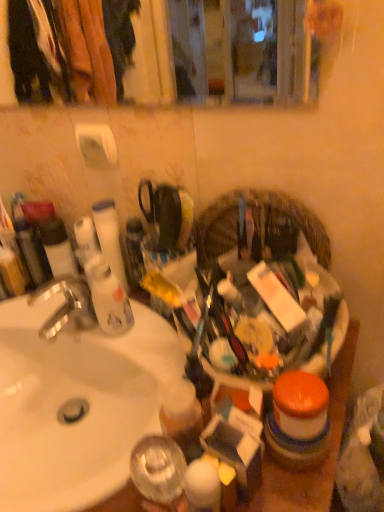
Find the location of `matte black tube at left`. matte black tube at left is located at coordinates (57, 247).

In order to face white matte toilet paper at upper left, the 1th toilet paper in the top-to-bottom sequence, should I rotate leftwards or rightwards?

A 13.010 degree turn to the left will do.

Measure the distance between white matte tube at left, the first toilet paper when ordered from bottom to top, and camera.

A distance of 32.99 inches exists between white matte tube at left, the first toilet paper when ordered from bottom to top, and camera.

What is the approximate width of white matte tube at left, placed as the 2th toilet paper when sorted from top to bottom?

The width of white matte tube at left, placed as the 2th toilet paper when sorted from top to bottom, is 2.93 inches.

Locate an element on the screen. This screenshot has width=384, height=512. plastic woven basket at center is located at coordinates (254, 206).

Based on the photo, what is the approximate height of silver metallic faucet at left?

silver metallic faucet at left is 5.10 inches tall.

You are a GUI agent. You are given a task and a screenshot of the screen. Output one action in this format:
    pyautogui.click(x=<x>, y=<y>)
    Task: Click on the matte black tube at left
    
    Given the screenshot: What is the action you would take?
    pyautogui.click(x=57, y=247)

Is matte black tube at left bigger or smaller than silver metallic faucet at left?

Considering their sizes, matte black tube at left takes up less space than silver metallic faucet at left.

Is silver metallic faucet at left at the back of matte black tube at left?

matte black tube at left does not have its back to silver metallic faucet at left.

In the scene shown: Is matte black tube at left not within silver metallic faucet at left?

That's correct, matte black tube at left is outside of silver metallic faucet at left.

From a real-world perspective, is matte black tube at left beneath plastic woven basket at center?

Indeed, from a real-world perspective, matte black tube at left is positioned beneath plastic woven basket at center.

How different are the orientations of matte black tube at left and plastic woven basket at center in degrees?

The angle between the facing direction of matte black tube at left and the facing direction of plastic woven basket at center is 0.00618 degrees.

Which is nearer, (53, 270) or (298, 215)?

Clearly, point (53, 270) is more distant from the camera than point (298, 215).

Is matte black tube at left oriented towards plastic woven basket at center?

No, matte black tube at left is not aimed at plastic woven basket at center.

In the scene shown: Is white matte tube at left, placed as the 2th toilet paper when sorted from top to bottom, not inside white glossy sink at left?

That's correct, white matte tube at left, placed as the 2th toilet paper when sorted from top to bottom, is outside of white glossy sink at left.

Which of these two, white matte tube at left, placed as the 2th toilet paper when sorted from top to bottom, or white glossy sink at left, stands taller?

white matte tube at left, placed as the 2th toilet paper when sorted from top to bottom, is taller.

Can you tell me how much white matte tube at left, placed as the 2th toilet paper when sorted from top to bottom, and white glossy sink at left differ in facing direction?

The facing directions of white matte tube at left, placed as the 2th toilet paper when sorted from top to bottom, and white glossy sink at left are 0.000879 degrees apart.

Who is more distant, white matte tube at left, the first toilet paper when ordered from bottom to top, or white glossy sink at left?

white matte tube at left, the first toilet paper when ordered from bottom to top.

Looking at this image, is silver metallic faucet at left surrounded by white matte tube at left, the first toilet paper when ordered from bottom to top?

No.

From the image's perspective, which toilet paper is the 1st one above the silver metallic faucet at left? Please provide its 2D coordinates.

[(110, 237)]

Considering the positions of objects white matte tube at left, placed as the 2th toilet paper when sorted from top to bottom, and silver metallic faucet at left in the image provided, who is in front, white matte tube at left, placed as the 2th toilet paper when sorted from top to bottom, or silver metallic faucet at left?

silver metallic faucet at left.

What's the angular difference between white glossy sink at left and matte black tube at left's facing directions?

0.00199 degrees.

Considering the sizes of objects white glossy sink at left and matte black tube at left in the image provided, who is wider, white glossy sink at left or matte black tube at left?

With larger width is white glossy sink at left.

Which of these two, white glossy sink at left or matte black tube at left, stands shorter?

Standing shorter between the two is matte black tube at left.

Can you see white glossy sink at left touching matte black tube at left?

No, white glossy sink at left is not touching matte black tube at left.

From the image's perspective, which object appears higher, plastic woven basket at center or silver metallic faucet at left?

plastic woven basket at center appears higher in the image.

Is plastic woven basket at center with silver metallic faucet at left?

No, plastic woven basket at center is not making contact with silver metallic faucet at left.

Relative to silver metallic faucet at left, is plastic woven basket at center in front or behind?

Visually, plastic woven basket at center is located in front of silver metallic faucet at left.

Does silver metallic faucet at left touch plastic woven basket at center?

silver metallic faucet at left is not next to plastic woven basket at center, and they're not touching.

Find the location of a particular element. basket on the right of silver metallic faucet at left is located at coordinates (254, 206).

Which object is wider, silver metallic faucet at left or plastic woven basket at center?

Wider between the two is silver metallic faucet at left.

Considering the positions of points (65, 295) and (230, 195), is point (65, 295) farther from camera compared to point (230, 195)?

Yes, it is.

Find the location of a particular element. The height and width of the screenshot is (512, 384). faucet in front of the matte black tube at left is located at coordinates (66, 305).

This screenshot has height=512, width=384. I want to click on toiletry on the left of the plastic woven basket at center, so click(x=57, y=247).

When comparing their distances from plastic woven basket at center, does white glossy sink at left or matte black tube at left seem closer?

white glossy sink at left is positioned closer to the anchor plastic woven basket at center.

Which object lies nearer to the anchor point silver metallic faucet at left, white matte tube at left, the first toilet paper when ordered from bottom to top, or white matte toilet paper at upper left, the second toilet paper from the bottom?

white matte tube at left, the first toilet paper when ordered from bottom to top, lies closer to silver metallic faucet at left than the other object.

Consider the image. Estimate the real-world distances between objects in this image. Which object is further from white matte toilet paper at upper left, the second toilet paper from the bottom, matte black tube at left or white glossy sink at left?

The object further to white matte toilet paper at upper left, the second toilet paper from the bottom, is white glossy sink at left.

When comparing their distances from white matte tube at left, the first toilet paper when ordered from bottom to top, does plastic woven basket at center or matte black tube at left seem closer?

The object closer to white matte tube at left, the first toilet paper when ordered from bottom to top, is matte black tube at left.

Considering their positions, is white glossy sink at left positioned further to matte black tube at left than white matte tube at left, the first toilet paper when ordered from bottom to top?

Based on the image, white glossy sink at left appears to be further to matte black tube at left.

When comparing their distances from plastic woven basket at center, does silver metallic faucet at left or white matte toilet paper at upper left, the 1th toilet paper in the top-to-bottom sequence, seem closer?

Based on the image, white matte toilet paper at upper left, the 1th toilet paper in the top-to-bottom sequence, appears to be nearer to plastic woven basket at center.

From the image, which object appears to be farther from silver metallic faucet at left, plastic woven basket at center or white matte toilet paper at upper left, the 1th toilet paper in the top-to-bottom sequence?

The object further to silver metallic faucet at left is plastic woven basket at center.

Estimate the real-world distances between objects in this image. Which object is closer to white glossy sink at left, silver metallic faucet at left or white matte toilet paper at upper left, the second toilet paper from the bottom?

Based on the image, silver metallic faucet at left appears to be nearer to white glossy sink at left.

Locate an element on the screen. This screenshot has height=512, width=384. toiletry between white matte toilet paper at upper left, the 1th toilet paper in the top-to-bottom sequence, and silver metallic faucet at left from top to bottom is located at coordinates (57, 247).

Locate an element on the screen. faucet between white matte toilet paper at upper left, the second toilet paper from the bottom, and white glossy sink at left from top to bottom is located at coordinates (66, 305).

At what (x,y) coordinates should I click in order to perform the action: click on toiletry between white matte toilet paper at upper left, the second toilet paper from the bottom, and white glossy sink at left in the up-down direction. Please return your answer as a coordinate pair (x, y). Looking at the image, I should click on (57, 247).

You are a GUI agent. You are given a task and a screenshot of the screen. Output one action in this format:
    pyautogui.click(x=<x>, y=<y>)
    Task: Click on the faucet between white glossy sink at left and plastic woven basket at center
    This screenshot has height=512, width=384.
    Given the screenshot: What is the action you would take?
    coord(66,305)